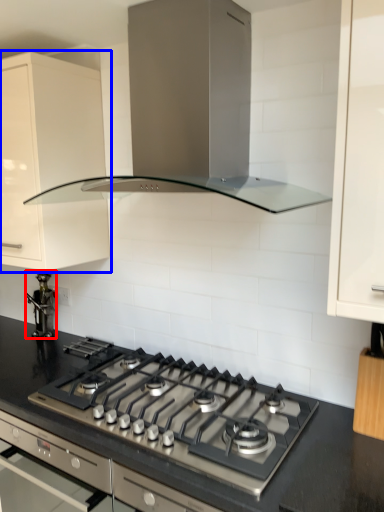
Question: Which of the following is the farthest to the observer, appliance (highlighted by a red box) or cabinetry (highlighted by a blue box)?

Choices:
 (A) appliance
 (B) cabinetry

Answer: (A)